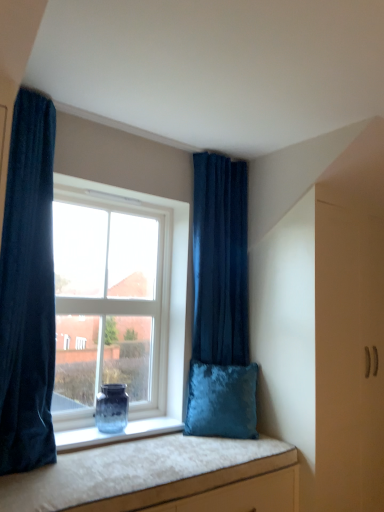
Measure the distance between point (199, 228) and camera.

A distance of 8.55 feet exists between point (199, 228) and camera.

What do you see at coordinates (28, 290) in the screenshot? I see `velvet dark blue curtain at left, the 2th curtain when ordered from back to front` at bounding box center [28, 290].

The image size is (384, 512). What do you see at coordinates (127, 469) in the screenshot?
I see `velvet cushion at lower center` at bounding box center [127, 469].

Image resolution: width=384 pixels, height=512 pixels. What do you see at coordinates (222, 401) in the screenshot?
I see `velvet blue pillow at window` at bounding box center [222, 401].

Where is `translucent glass vase at window`? The width and height of the screenshot is (384, 512). translucent glass vase at window is located at coordinates (112, 408).

Image resolution: width=384 pixels, height=512 pixels. What do you see at coordinates (112, 408) in the screenshot?
I see `translucent glass vase at window` at bounding box center [112, 408].

Locate an element on the screen. velvet dark blue curtain at upper center, marked as the 2th curtain in a front-to-back arrangement is located at coordinates (220, 261).

Does velvet dark blue curtain at left, arranged as the 1th curtain when viewed from the left, appear on the right side of velvet dark blue curtain at upper center, the first curtain viewed from the back?

No.

Considering the relative positions of velvet dark blue curtain at left, which is counted as the second curtain, starting from the right, and velvet dark blue curtain at upper center, which ranks as the 2th curtain in left-to-right order, in the image provided, is velvet dark blue curtain at left, which is counted as the second curtain, starting from the right, behind velvet dark blue curtain at upper center, which ranks as the 2th curtain in left-to-right order,?

That is False.

From the image's perspective, does velvet dark blue curtain at left, arranged as the 1th curtain when viewed from the left, appear lower than velvet dark blue curtain at upper center, acting as the 1th curtain starting from the right?

No, from the image's perspective, velvet dark blue curtain at left, arranged as the 1th curtain when viewed from the left, is not beneath velvet dark blue curtain at upper center, acting as the 1th curtain starting from the right.

Which of these two, clear glass window at center or velvet dark blue curtain at left, which is counted as the second curtain, starting from the right, stands shorter?

clear glass window at center.

From the picture: Is clear glass window at center oriented away from velvet dark blue curtain at left, which is counted as the second curtain, starting from the right?

No, clear glass window at center is not facing the opposite direction of velvet dark blue curtain at left, which is counted as the second curtain, starting from the right.

Consider the image. From the image's perspective, is clear glass window at center located above velvet dark blue curtain at left, positioned as the 1th curtain in front-to-back order?

Incorrect, from the image's perspective, clear glass window at center is lower than velvet dark blue curtain at left, positioned as the 1th curtain in front-to-back order.

Does clear glass window at center have a greater width compared to velvet dark blue curtain at left, positioned as the 1th curtain in front-to-back order?

In fact, clear glass window at center might be narrower than velvet dark blue curtain at left, positioned as the 1th curtain in front-to-back order.

Consider the image. Would you say velvet dark blue curtain at left, which is counted as the second curtain, starting from the right, is part of translucent glass vase at window's contents?

No, velvet dark blue curtain at left, which is counted as the second curtain, starting from the right, is not surrounded by translucent glass vase at window.

From the picture: Is translucent glass vase at window beside velvet dark blue curtain at left, the 2th curtain when ordered from back to front?

No.

Considering the positions of points (124, 396) and (21, 387), is point (124, 396) closer to camera compared to point (21, 387)?

No, (124, 396) is behind (21, 387).

In the scene shown: Can you confirm if translucent glass vase at window is wider than velvet dark blue curtain at left, the 2th curtain when ordered from back to front?

Incorrect, the width of translucent glass vase at window does not surpass that of velvet dark blue curtain at left, the 2th curtain when ordered from back to front.

Consider the image. Considering the relative positions of velvet blue pillow at window and translucent glass vase at window in the image provided, is velvet blue pillow at window to the left or to the right of translucent glass vase at window?

velvet blue pillow at window is positioned on translucent glass vase at window's right side.

Is velvet blue pillow at window oriented away from translucent glass vase at window?

velvet blue pillow at window is not turned away from translucent glass vase at window.

From a real-world perspective, relative to translucent glass vase at window, is velvet blue pillow at window vertically above or below?

Clearly, from a real-world perspective, velvet blue pillow at window is above translucent glass vase at window.

Looking at their sizes, would you say velvet blue pillow at window is wider or thinner than translucent glass vase at window?

In the image, velvet blue pillow at window appears to be wider than translucent glass vase at window.

From a real-world perspective, who is located higher, velvet dark blue curtain at left, positioned as the 1th curtain in front-to-back order, or translucent glass vase at window?

From a 3D spatial view, velvet dark blue curtain at left, positioned as the 1th curtain in front-to-back order, is above.

Considering the relative sizes of velvet dark blue curtain at left, the 2th curtain when ordered from back to front, and translucent glass vase at window in the image provided, is velvet dark blue curtain at left, the 2th curtain when ordered from back to front, shorter than translucent glass vase at window?

No.

Is velvet dark blue curtain at left, which is counted as the second curtain, starting from the right, in front of translucent glass vase at window?

Yes, it is in front of translucent glass vase at window.

Would you say clear glass window at center is inside or outside velvet blue pillow at window?

clear glass window at center lies outside velvet blue pillow at window.

Is clear glass window at center oriented towards velvet blue pillow at window?

No, clear glass window at center is not aimed at velvet blue pillow at window.

In terms of size, does clear glass window at center appear bigger or smaller than velvet blue pillow at window?

clear glass window at center is bigger than velvet blue pillow at window.

Considering the relative sizes of clear glass window at center and velvet blue pillow at window in the image provided, is clear glass window at center shorter than velvet blue pillow at window?

In fact, clear glass window at center may be taller than velvet blue pillow at window.

How different are the orientations of velvet blue pillow at window and velvet dark blue curtain at left, the 2th curtain when ordered from back to front, in degrees?

33.6 degrees.

Is velvet blue pillow at window positioned with its back to velvet dark blue curtain at left, the 2th curtain when ordered from back to front?

That's not correct — velvet blue pillow at window is not looking away from velvet dark blue curtain at left, the 2th curtain when ordered from back to front.

Find the location of a particular element. This screenshot has height=512, width=384. curtain in front of the velvet blue pillow at window is located at coordinates (28, 290).

Is velvet blue pillow at window beside velvet dark blue curtain at left, arranged as the 1th curtain when viewed from the left?

velvet blue pillow at window and velvet dark blue curtain at left, arranged as the 1th curtain when viewed from the left, are clearly separated.

Locate an element on the screen. This screenshot has height=512, width=384. curtain below the velvet dark blue curtain at left, positioned as the 1th curtain in front-to-back order (from the image's perspective) is located at coordinates (220, 261).

In order to click on window below the velvet dark blue curtain at left, which is counted as the second curtain, starting from the right (from a real-world perspective) in this screenshot , I will do `click(113, 295)`.

From the picture: Based on their spatial positions, is velvet cushion at lower center or velvet dark blue curtain at upper center, which ranks as the 2th curtain in left-to-right order, further from clear glass window at center?

velvet cushion at lower center lies further to clear glass window at center than the other object.

When comparing their distances from velvet dark blue curtain at upper center, marked as the 2th curtain in a front-to-back arrangement, does velvet dark blue curtain at left, which is counted as the second curtain, starting from the right, or translucent glass vase at window seem closer?

translucent glass vase at window lies closer to velvet dark blue curtain at upper center, marked as the 2th curtain in a front-to-back arrangement, than the other object.

Estimate the real-world distances between objects in this image. Which object is closer to velvet dark blue curtain at upper center, the first curtain viewed from the back, translucent glass vase at window or velvet cushion at lower center?

translucent glass vase at window lies closer to velvet dark blue curtain at upper center, the first curtain viewed from the back, than the other object.

When comparing their distances from velvet blue pillow at window, does clear glass window at center or translucent glass vase at window seem further?

The object further to velvet blue pillow at window is clear glass window at center.

Which object lies nearer to the anchor point velvet cushion at lower center, velvet dark blue curtain at upper center, acting as the 1th curtain starting from the right, or velvet blue pillow at window?

The object closer to velvet cushion at lower center is velvet blue pillow at window.

Estimate the real-world distances between objects in this image. Which object is further from velvet cushion at lower center, velvet dark blue curtain at left, which is counted as the second curtain, starting from the right, or translucent glass vase at window?

velvet dark blue curtain at left, which is counted as the second curtain, starting from the right.

Based on their spatial positions, is velvet dark blue curtain at left, which is counted as the second curtain, starting from the right, or velvet cushion at lower center further from clear glass window at center?

Based on the image, velvet cushion at lower center appears to be further to clear glass window at center.

Which object lies nearer to the anchor point velvet dark blue curtain at left, the 2th curtain when ordered from back to front, velvet cushion at lower center or translucent glass vase at window?

velvet cushion at lower center.

The height and width of the screenshot is (512, 384). In order to click on pillow between velvet dark blue curtain at left, arranged as the 1th curtain when viewed from the left, and velvet cushion at lower center from top to bottom in this screenshot , I will do `click(222, 401)`.

Locate an element on the screen. This screenshot has height=512, width=384. window situated between velvet dark blue curtain at left, the 2th curtain when ordered from back to front, and velvet blue pillow at window from left to right is located at coordinates (113, 295).

Locate an element on the screen. The image size is (384, 512). window located between velvet cushion at lower center and translucent glass vase at window in the depth direction is located at coordinates (113, 295).

The height and width of the screenshot is (512, 384). What are the coordinates of `vase between velvet dark blue curtain at left, the 2th curtain when ordered from back to front, and velvet dark blue curtain at upper center, the first curtain viewed from the back, in the front-back direction` in the screenshot? It's located at (112, 408).